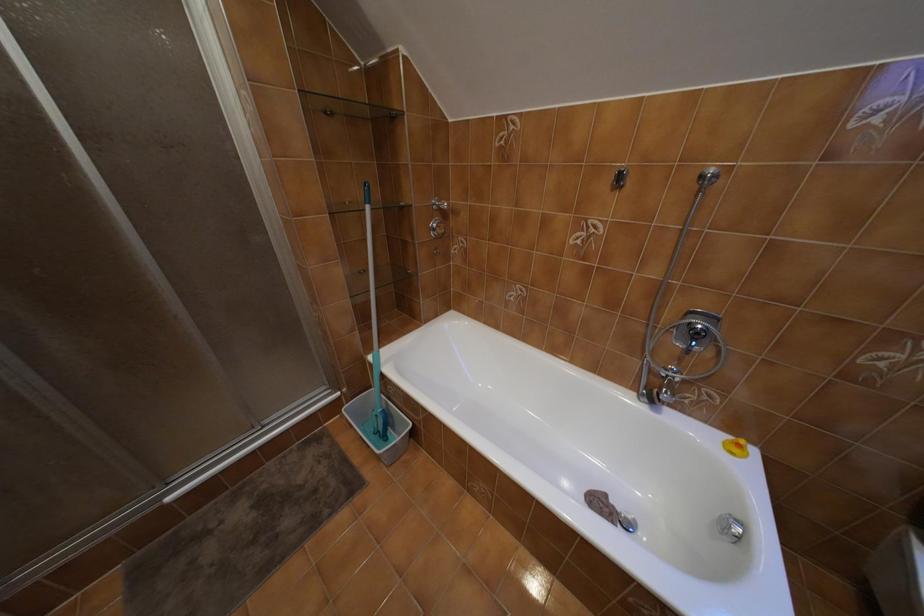
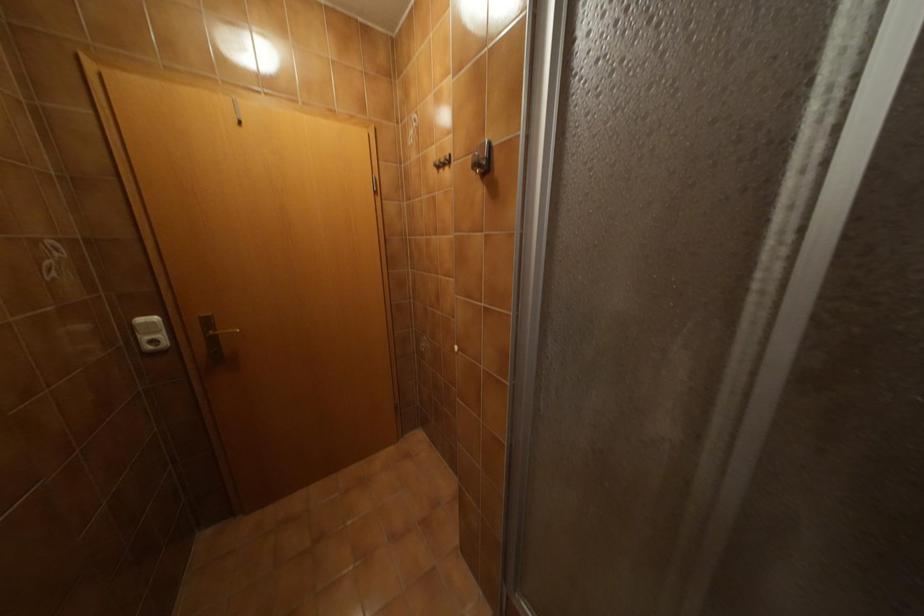
First-person continuous shooting, in which direction is the camera rotating?

The camera's rotation is toward left-down.